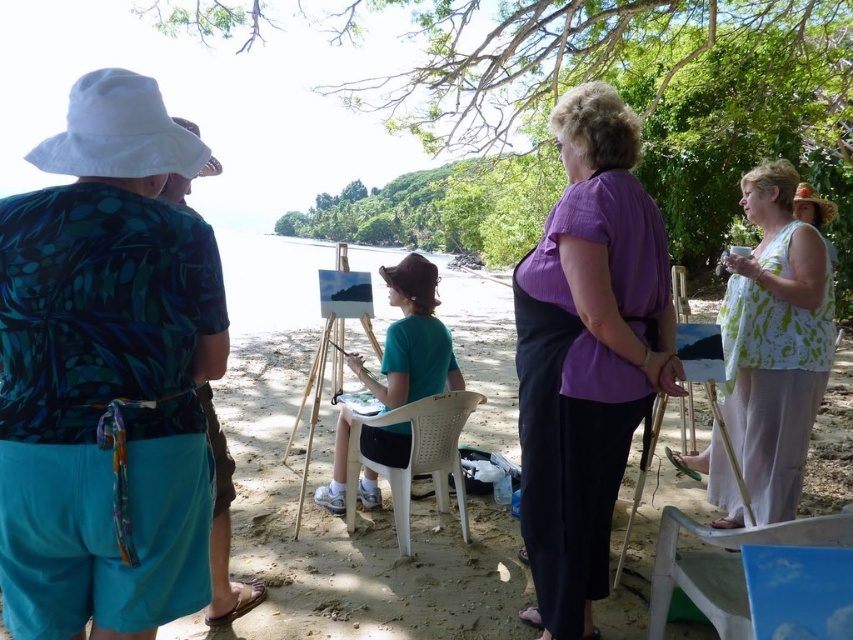
Question: Is smooth sand beach at center below white plastic chair at center?

Choices:
 (A) no
 (B) yes

Answer: (A)

Question: Is teal fabric shirt at center below white plastic chair at center?

Choices:
 (A) no
 (B) yes

Answer: (A)

Question: Estimate the real-world distances between objects in this image. Which object is farther from the matte green shirt at left?

Choices:
 (A) white plastic chair at center
 (B) purple cotton shirt at center
 (C) white printed blouse at center
 (D) teal fabric shirt at center

Answer: (C)

Question: Can you confirm if white printed blouse at center is positioned below matte green shirt at left?

Choices:
 (A) no
 (B) yes

Answer: (A)

Question: Which point appears closest to the camera in this image?

Choices:
 (A) (442, 328)
 (B) (566, 417)

Answer: (B)

Question: Which object is the farthest from the matte green shirt at left?

Choices:
 (A) white printed blouse at center
 (B) purple cotton shirt at center
 (C) teal fabric shirt at center
 (D) smooth sand beach at center

Answer: (D)